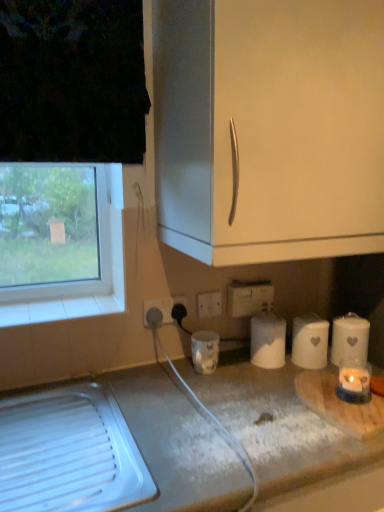
Identify the location of free point in front of white ceramic candle at lower center. (216, 397).